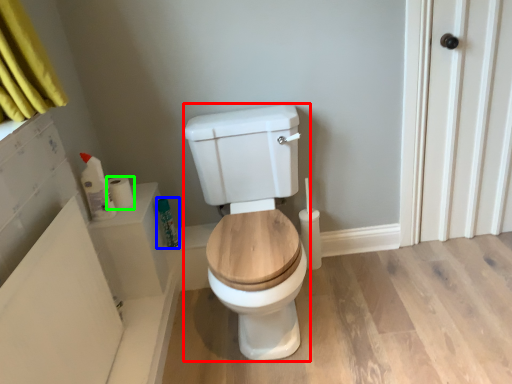
Question: Considering the real-world distances, which object is closest to porcelain (highlighted by a red box)? toiletry (highlighted by a blue box) or toilet paper (highlighted by a green box).

Choices:
 (A) toiletry
 (B) toilet paper

Answer: (A)